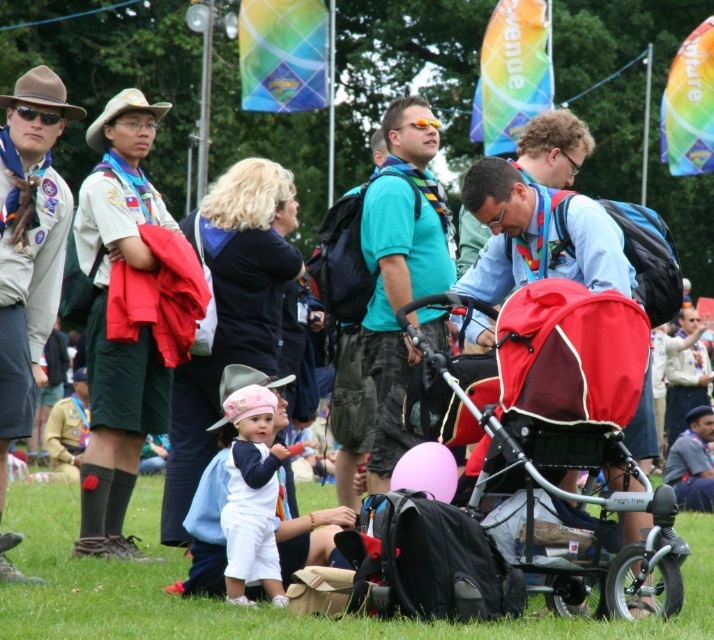
Question: Which object is positioned closest to the teal fabric shirt at center?

Choices:
 (A) green grass at lower center
 (B) khaki uniform at center
 (C) khaki uniform at left

Answer: (B)

Question: Does pink fabric baby at center appear under pink matte balloon at center?

Choices:
 (A) yes
 (B) no

Answer: (A)

Question: Which is nearer to the red fabric baby carriage at center?

Choices:
 (A) teal fabric shirt at center
 (B) pink fabric baby at center

Answer: (B)

Question: Is pink fabric baby at center above pink matte balloon at center?

Choices:
 (A) no
 (B) yes

Answer: (A)

Question: Based on their relative distances, which object is farther from the khaki uniform at left?

Choices:
 (A) khaki uniform at center
 (B) teal fabric shirt at center

Answer: (B)

Question: Does red fabric baby carriage at center lie behind pink matte balloon at center?

Choices:
 (A) yes
 (B) no

Answer: (B)